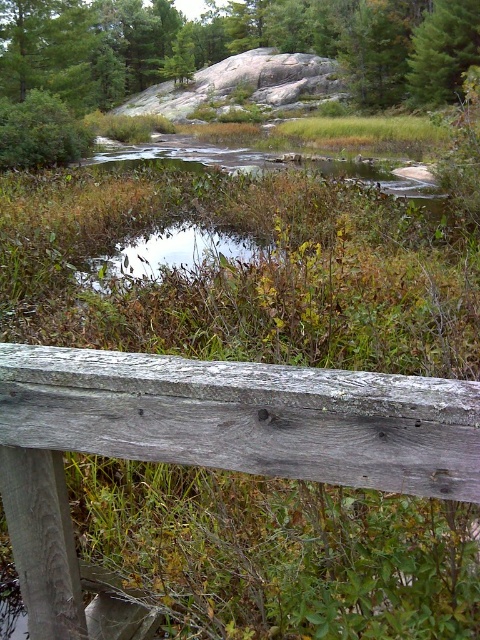
You are standing at the edge of the wooden railing in the scene. You want to walk to the green grassy puddle at center. Which direction should you move relative to your current position?

Since the green grassy puddle at center is located at point (170, 253) in the 2D space, you should move towards the center of the image from the wooden railing at the edge to reach it.

You are an environmental scientist assessing the landscape. You need to determine which object occupies more horizontal space between the green textured rock at upper center and the green grassy puddle at center. Which one is wider?

The green textured rock at upper center is wider than the green grassy puddle at center.

You are standing on the wooden railing and want to step onto the green grassy puddle at center. Is the green textured rock at upper center in your way?

The green textured rock at upper center is positioned over the green grassy puddle at center, so stepping onto the puddle would require navigating around the rock.